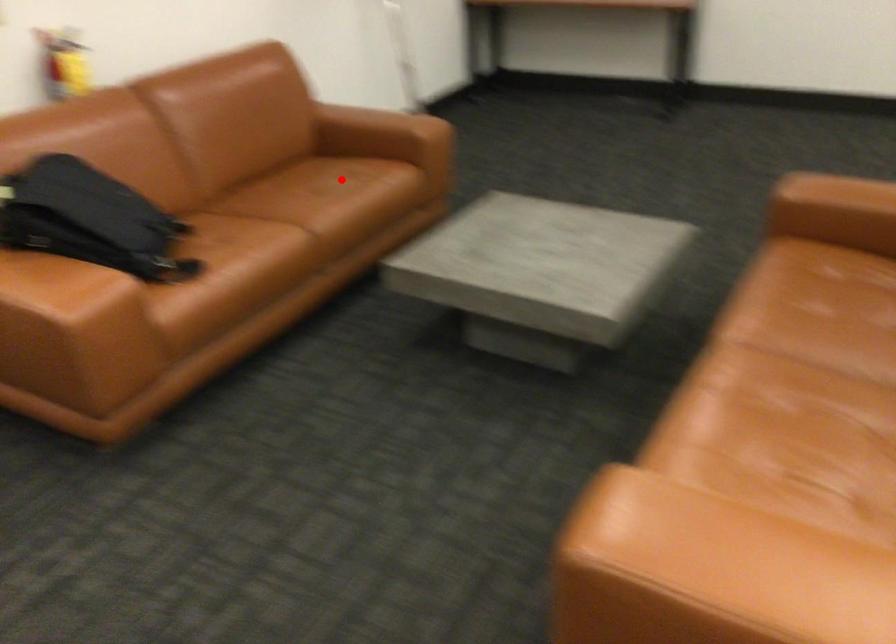
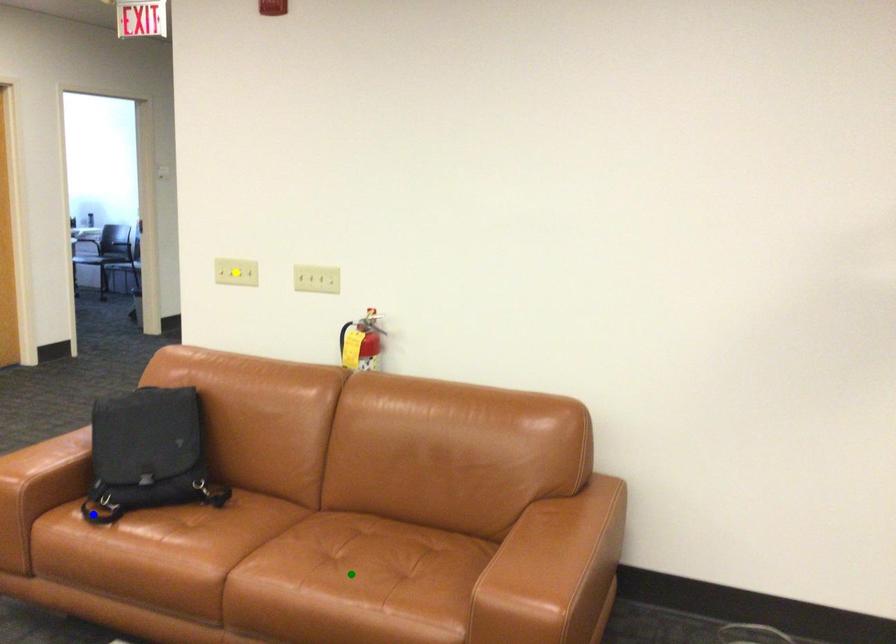
Question: I am providing you with two images of the same scene from different viewpoints. A red point is marked on the first image. You are given multiple points on the second image. Which spot in image 2 lines up with the point in image 1?

Choices:
 (A) yellow point
 (B) green point
 (C) blue point

Answer: (B)